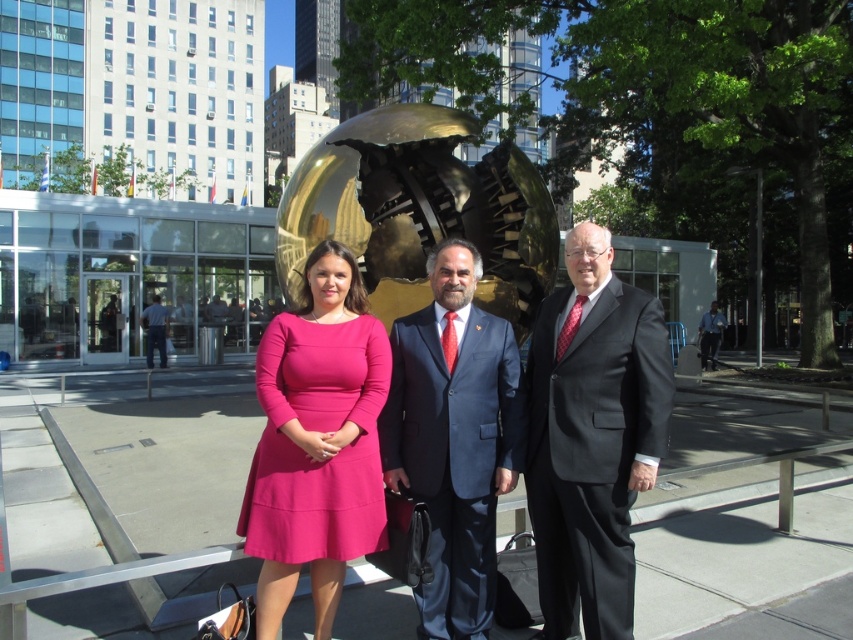
Question: Is blue suit at center below matte pink dress at center?

Choices:
 (A) no
 (B) yes

Answer: (B)

Question: Among these objects, which one is farthest from the camera?

Choices:
 (A) matte black suit at center
 (B) pink satin dress at center
 (C) gold polished sphere at center

Answer: (C)

Question: Is blue jeans at left further to camera compared to blue denim jeans at right?

Choices:
 (A) yes
 (B) no

Answer: (B)

Question: Which object is the farthest from the blue denim jeans at right?

Choices:
 (A) matte pink dress at center
 (B) pink satin dress at center
 (C) gold polished sphere at center

Answer: (A)

Question: Which point is farther from the camera taking this photo?

Choices:
 (A) click(627, 637)
 (B) click(467, 461)
 (C) click(706, 336)
 (D) click(527, 236)

Answer: (C)

Question: Does matte black suit at center lie behind blue jeans at left?

Choices:
 (A) yes
 (B) no

Answer: (B)